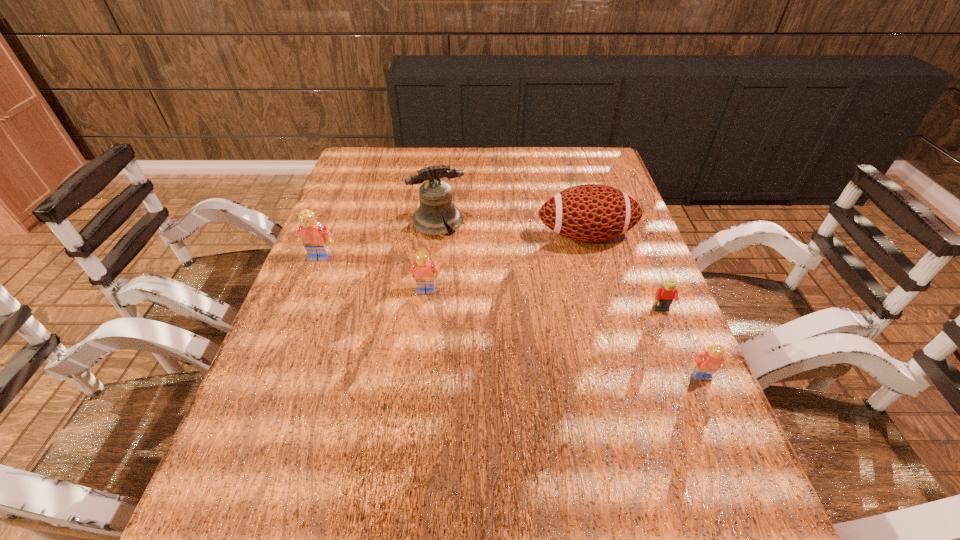
Where is `the tallest Lego`? the tallest Lego is located at coordinates (315, 238).

This screenshot has height=540, width=960. Find the location of `the leftmost object`. the leftmost object is located at coordinates (315, 238).

This screenshot has height=540, width=960. I want to click on the second tallest Lego, so click(x=424, y=270).

I want to click on the third Lego from right to left, so pyautogui.click(x=424, y=270).

Identify the location of the nearest Lego. (705, 364).

Find the location of a particular element. This screenshot has height=540, width=960. football is located at coordinates (591, 212).

Identify the location of bell. (436, 202).

Where is `the third farthest Lego`? Image resolution: width=960 pixels, height=540 pixels. the third farthest Lego is located at coordinates (664, 296).

Where is `vacant space located 0.130m on the front-facing side of the tallest Lego`? vacant space located 0.130m on the front-facing side of the tallest Lego is located at coordinates (304, 298).

Image resolution: width=960 pixels, height=540 pixels. In order to click on free location located 0.080m on the front-facing side of the third shortest object in this screenshot , I will do `click(422, 320)`.